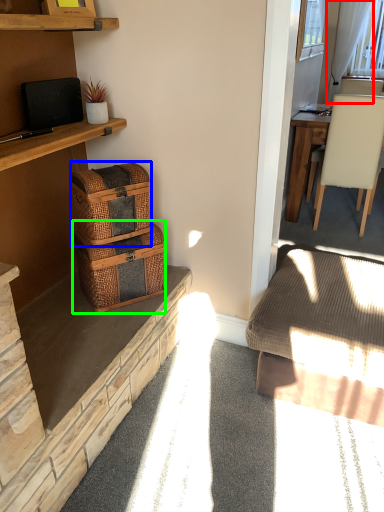
Question: Which object is the farthest from curtain (highlighted by a red box)? Choose among these: picnic basket (highlighted by a blue box) or picnic basket (highlighted by a green box).

Choices:
 (A) picnic basket
 (B) picnic basket

Answer: (B)